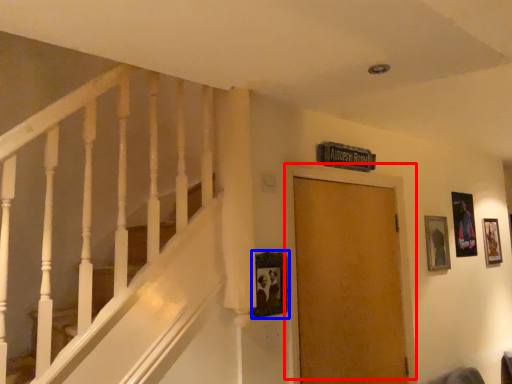
Question: Which object is closer to the camera taking this photo, door (highlighted by a red box) or picture frame (highlighted by a blue box)?

Choices:
 (A) door
 (B) picture frame

Answer: (B)